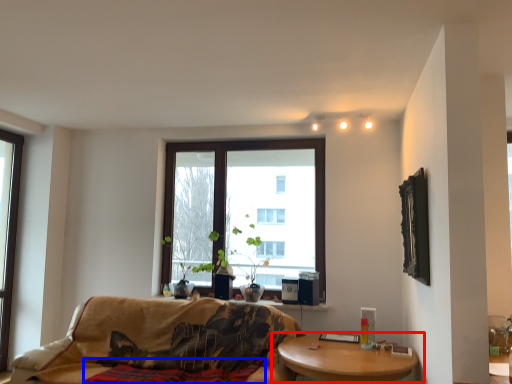
Question: Among these objects, which one is nearest to the camera, coffee table (highlighted by a red box) or blanket (highlighted by a blue box)?

Choices:
 (A) coffee table
 (B) blanket

Answer: (A)